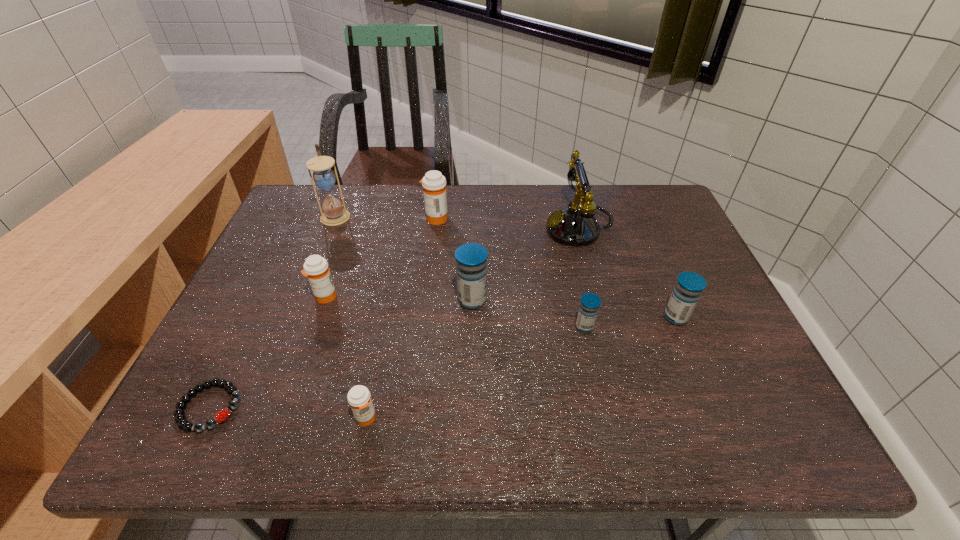
You are a GUI agent. You are given a task and a screenshot of the screen. Output one action in this format:
    pyautogui.click(x=<x>, y=<y>)
    Task: Click on the free spot located on the left of the rightmost orange medicine
    
    Given the screenshot: What is the action you would take?
    pyautogui.click(x=323, y=218)

The image size is (960, 540). In order to click on vacant space located on the right of the biggest blue medicine in this screenshot , I will do `click(589, 300)`.

Find the location of a particular element. This screenshot has width=960, height=540. free region located on the right of the second smallest orange medicine is located at coordinates (492, 297).

Locate an element on the screen. The width and height of the screenshot is (960, 540). vacant space located on the left of the rightmost medicine is located at coordinates (578, 318).

Find the location of a particular element. This screenshot has width=960, height=540. free space located on the back of the second medicine from right to left is located at coordinates (561, 218).

The width and height of the screenshot is (960, 540). Find the location of `vacant space located on the back of the nearest medicine`. vacant space located on the back of the nearest medicine is located at coordinates tap(375, 373).

The height and width of the screenshot is (540, 960). Find the location of `vacant space located on the back of the bracelet`. vacant space located on the back of the bracelet is located at coordinates (269, 286).

I want to click on hourglass present at the far edge, so click(324, 177).

Find the location of a particular element. The height and width of the screenshot is (540, 960). telephone present at the far edge is located at coordinates (575, 225).

What are the coordinates of `medicine that is at the far edge` in the screenshot? It's located at (434, 183).